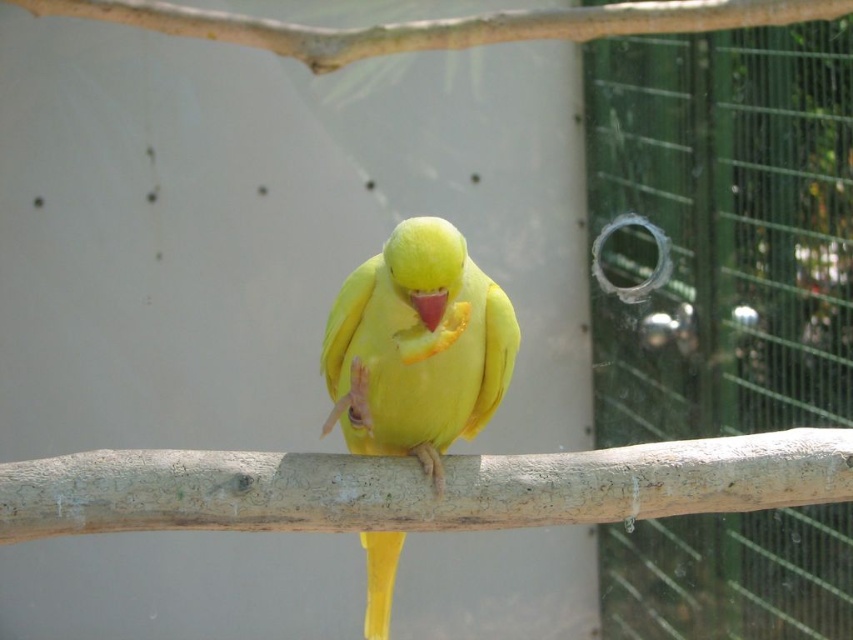
You are a bird trainer observing a yellow matte parrot at center perched on a smooth wood branch at center. You need to place a treat between them. What is the minimum distance you should keep between the treat and the parrot to ensure it stays on the branch?

The minimum distance should be 6.14 inches, as the smooth wood branch at center is 6.14 inches away from the yellow matte parrot at center, so placing the treat at that distance ensures the parrot remains on the branch.

You are an ornithologist observing the yellow matte parrot at center and the smooth wood branch at upper center. Which object is positioned closer to your line of sight?

The yellow matte parrot at center is closer to the viewer than the smooth wood branch at upper center.